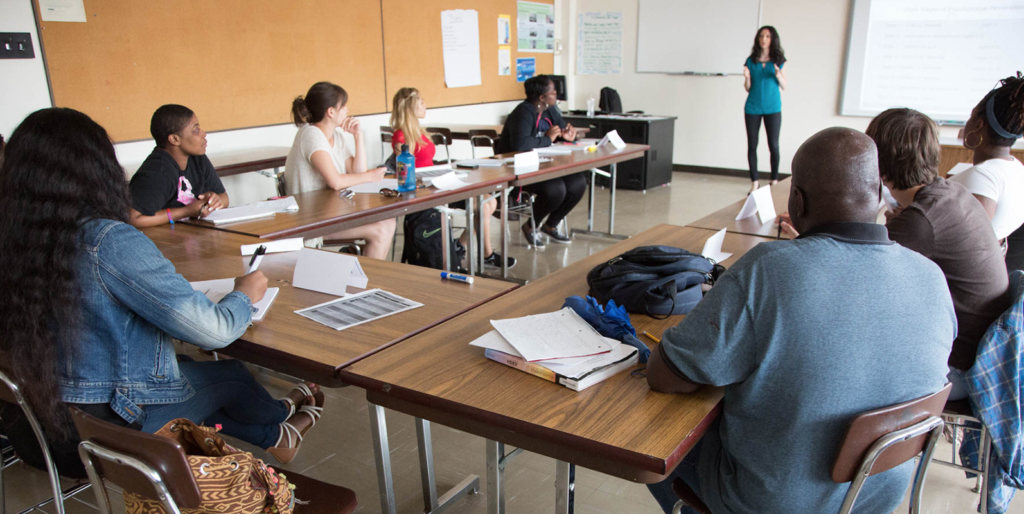
Identify the location of dry erase board. (687, 38).